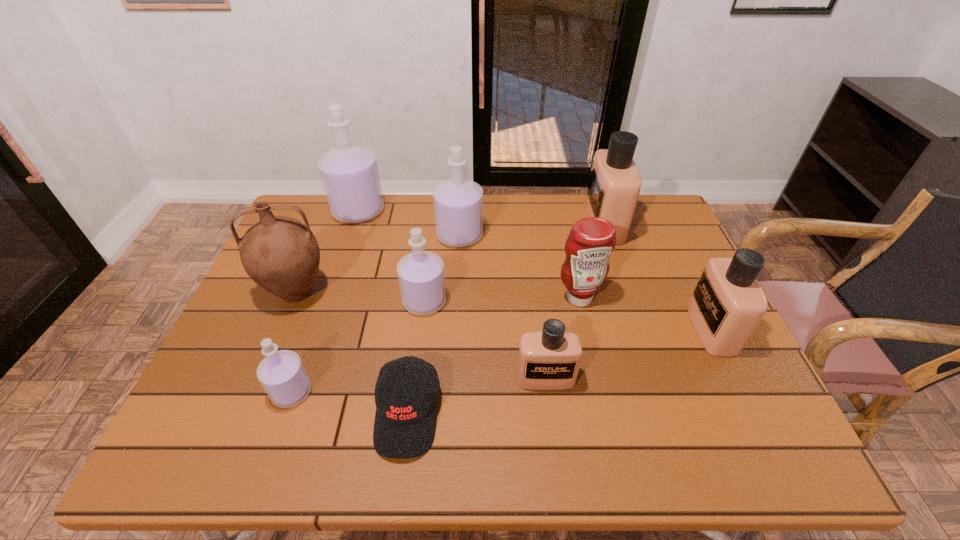
The width and height of the screenshot is (960, 540). I want to click on free spot located on the back of the brown pitcher, so click(x=328, y=217).

Where is `free space located on the left of the red condiment`? free space located on the left of the red condiment is located at coordinates (452, 298).

You are a GUI agent. You are given a task and a screenshot of the screen. Output one action in this format:
    pyautogui.click(x=<x>, y=<y>)
    Task: Click on the free space located 0.340m on the left of the third farthest purple perfume
    
    Given the screenshot: What is the action you would take?
    pyautogui.click(x=276, y=301)

The width and height of the screenshot is (960, 540). Find the location of `free space located on the front label of the rightmost beige perfume`. free space located on the front label of the rightmost beige perfume is located at coordinates (618, 329).

Locate an element on the screen. Image resolution: width=960 pixels, height=540 pixels. free space located on the front label of the rightmost beige perfume is located at coordinates (598, 329).

Identify the location of free space located 0.350m on the front label of the rightmost beige perfume. This screenshot has width=960, height=540. (555, 329).

Identify the location of vacant space located on the right of the nearest purple perfume. (411, 392).

The width and height of the screenshot is (960, 540). What are the coordinates of `vacant region located 0.140m on the front label of the smallest beige perfume` in the screenshot? It's located at (555, 452).

In order to click on object that is at the near edge in this screenshot , I will do `click(404, 427)`.

Find the location of `pitcher at the left edge`. pitcher at the left edge is located at coordinates (281, 254).